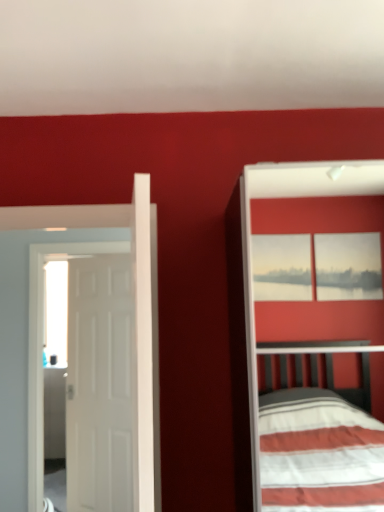
Question: Can you confirm if white matte door at left, which is counted as the 1th door, starting from the front, is shorter than white matte door at left, acting as the first door starting from the back?

Choices:
 (A) yes
 (B) no

Answer: (A)

Question: Can you confirm if white matte door at left, the 2th door positioned from the back, is bigger than white matte door at left, acting as the first door starting from the back?

Choices:
 (A) no
 (B) yes

Answer: (B)

Question: Is white matte door at left, which is counted as the 1th door, starting from the front, placed right next to white matte door at left, acting as the first door starting from the back?

Choices:
 (A) yes
 (B) no

Answer: (A)

Question: Considering the relative sizes of white matte door at left, which is counted as the 1th door, starting from the front, and white matte door at left, which is counted as the second door, starting from the front, in the image provided, is white matte door at left, which is counted as the 1th door, starting from the front, thinner than white matte door at left, which is counted as the second door, starting from the front,?

Choices:
 (A) no
 (B) yes

Answer: (A)

Question: From the image's perspective, is white matte door at left, which is counted as the 1th door, starting from the front, below white matte door at left, acting as the first door starting from the back?

Choices:
 (A) yes
 (B) no

Answer: (B)

Question: Is white matte door at left, which is counted as the 1th door, starting from the front, positioned behind white matte door at left, which is counted as the second door, starting from the front?

Choices:
 (A) no
 (B) yes

Answer: (A)

Question: Considering the relative positions of white matte door at left, acting as the first door starting from the back, and white matte door at left, the 2th door positioned from the back, in the image provided, is white matte door at left, acting as the first door starting from the back, to the left of white matte door at left, the 2th door positioned from the back, from the viewer's perspective?

Choices:
 (A) no
 (B) yes

Answer: (B)

Question: Considering the relative sizes of white matte door at left, acting as the first door starting from the back, and white matte door at left, the 2th door positioned from the back, in the image provided, is white matte door at left, acting as the first door starting from the back, smaller than white matte door at left, the 2th door positioned from the back,?

Choices:
 (A) no
 (B) yes

Answer: (B)

Question: Can you confirm if white matte door at left, acting as the first door starting from the back, is positioned to the right of white matte door at left, the 2th door positioned from the back?

Choices:
 (A) no
 (B) yes

Answer: (A)

Question: Is white matte door at left, which is counted as the second door, starting from the front, taller than white matte door at left, which is counted as the 1th door, starting from the front?

Choices:
 (A) no
 (B) yes

Answer: (B)

Question: Is white matte door at left, acting as the first door starting from the back, positioned far away from white matte door at left, which is counted as the 1th door, starting from the front?

Choices:
 (A) no
 (B) yes

Answer: (A)

Question: Is white matte door at left, the 2th door positioned from the back, completely or partially inside white matte door at left, which is counted as the second door, starting from the front?

Choices:
 (A) no
 (B) yes

Answer: (A)

Question: Is white matte door at left, which is counted as the second door, starting from the front, wider or thinner than white matte door at left, which is counted as the 1th door, starting from the front?

Choices:
 (A) thin
 (B) wide

Answer: (A)